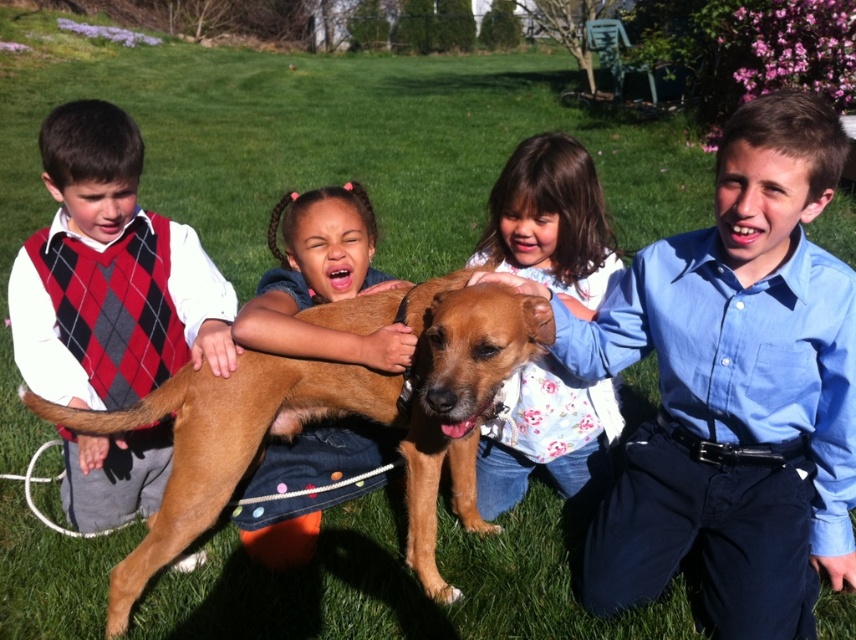
Question: Does argyle sweater vest at left come in front of brown fur dog at center?

Choices:
 (A) yes
 (B) no

Answer: (B)

Question: Does blue cotton shirt at right lie behind brown fur dog at center?

Choices:
 (A) no
 (B) yes

Answer: (A)

Question: Estimate the real-world distances between objects in this image. Which object is farther from the argyle sweater vest at left?

Choices:
 (A) fluffy white shirt at center
 (B) blue cotton shirt at right
 (C) brown fur dog at center
 (D) brown furry dog at center

Answer: (B)

Question: Which of the following is the closest to the observer?

Choices:
 (A) (134, 320)
 (B) (520, 193)
 (C) (270, 477)
 (D) (764, 470)

Answer: (D)

Question: Can you confirm if blue cotton shirt at right is positioned below brown fur dog at center?

Choices:
 (A) no
 (B) yes

Answer: (B)

Question: Among these objects, which one is farthest from the camera?

Choices:
 (A) brown furry dog at center
 (B) blue cotton shirt at right

Answer: (B)